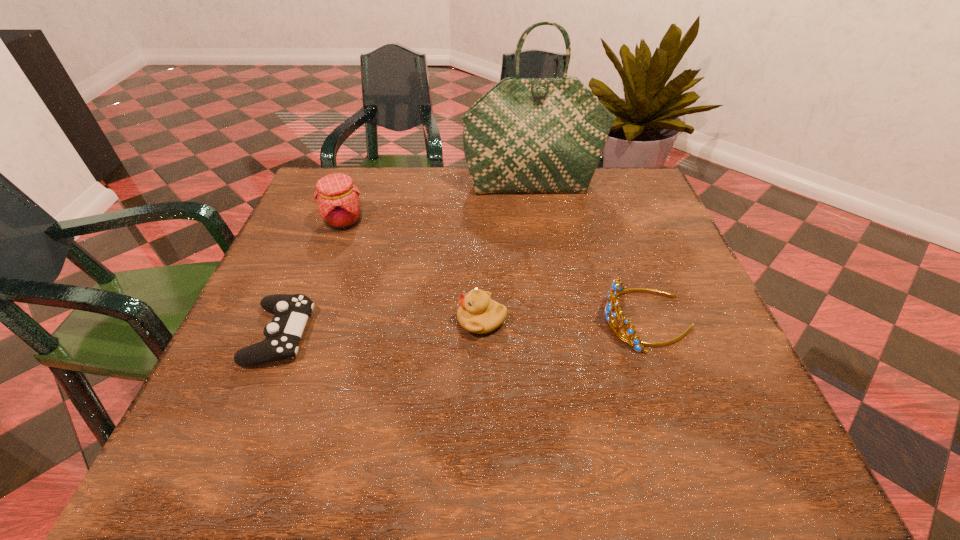
You are a GUI agent. You are given a task and a screenshot of the screen. Output one action in this format:
    pyautogui.click(x=<x>, y=<y>)
    Task: Click on the vacant area situated on the front-facing side of the tiara
    This screenshot has height=540, width=960.
    Given the screenshot: What is the action you would take?
    pyautogui.click(x=497, y=320)

Find the location of a particular element. free spot located 0.300m on the front-facing side of the duckling is located at coordinates (305, 320).

At what (x,y) coordinates should I click in order to perform the action: click on free region located on the front-facing side of the duckling. Please return your answer as a coordinate pair (x, y). The width and height of the screenshot is (960, 540). Looking at the image, I should click on pos(381,320).

Where is `free location located on the front-facing side of the duckling`? free location located on the front-facing side of the duckling is located at coordinates point(310,320).

This screenshot has width=960, height=540. I want to click on blank space located on the surface of the control, so click(356, 335).

Identify the location of tote bag located at the far edge. (525, 135).

This screenshot has width=960, height=540. I want to click on jam positioned at the far edge, so click(x=337, y=197).

Where is `jam present at the left edge`? This screenshot has width=960, height=540. jam present at the left edge is located at coordinates (337, 197).

Find the location of a particular element. Image resolution: width=960 pixels, height=540 pixels. control positioned at the left edge is located at coordinates (291, 311).

Identify the location of tote bag situated at the right edge. (525, 135).